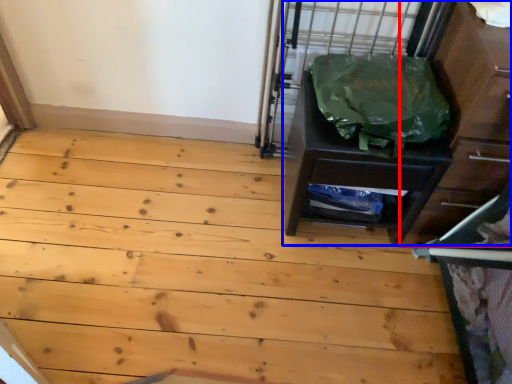
Question: Which of the following is the closest to the observer, dresser (highlighted by a red box) or chest of drawers (highlighted by a blue box)?

Choices:
 (A) dresser
 (B) chest of drawers

Answer: (A)